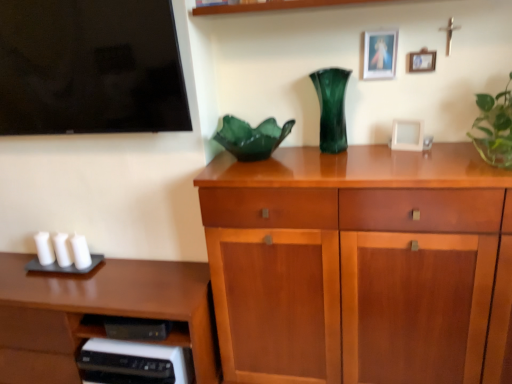
Question: Should I look upward or downward to see white matte candle at left, the second candle viewed from the left?

Choices:
 (A) up
 (B) down

Answer: (B)

Question: Can you confirm if white matte picture frame at upper right, which is counted as the third picture frame, starting from the top, is wider than wooden cabinet at center?

Choices:
 (A) yes
 (B) no

Answer: (B)

Question: Is white matte picture frame at upper right, which is counted as the third picture frame, starting from the top, far from wooden cabinet at center?

Choices:
 (A) no
 (B) yes

Answer: (A)

Question: Is white matte picture frame at upper right, marked as the 1th picture frame in a bottom-to-top arrangement, shorter than wooden cabinet at center?

Choices:
 (A) yes
 (B) no

Answer: (A)

Question: From a real-world perspective, is white matte picture frame at upper right, which is counted as the third picture frame, starting from the top, located beneath wooden cabinet at center?

Choices:
 (A) yes
 (B) no

Answer: (B)

Question: Could you tell me if white matte picture frame at upper right, marked as the 1th picture frame in a bottom-to-top arrangement, is facing wooden cabinet at center?

Choices:
 (A) yes
 (B) no

Answer: (B)

Question: Considering the relative sizes of white matte picture frame at upper right, marked as the 1th picture frame in a bottom-to-top arrangement, and wooden cabinet at center in the image provided, is white matte picture frame at upper right, marked as the 1th picture frame in a bottom-to-top arrangement, taller than wooden cabinet at center?

Choices:
 (A) yes
 (B) no

Answer: (B)

Question: Is green glossy plant at right, arranged as the 1th houseplant when viewed from the right, at the right side of green glass vase at center?

Choices:
 (A) no
 (B) yes

Answer: (B)

Question: Considering the relative sizes of green glossy plant at right, arranged as the 1th houseplant when viewed from the right, and green glass vase at center in the image provided, is green glossy plant at right, arranged as the 1th houseplant when viewed from the right, thinner than green glass vase at center?

Choices:
 (A) no
 (B) yes

Answer: (A)

Question: Is green glossy plant at right, arranged as the 1th houseplant when viewed from the right, to the left of green glass vase at center from the viewer's perspective?

Choices:
 (A) no
 (B) yes

Answer: (A)

Question: Is green glossy plant at right, which is the second houseplant in left-to-right order, not within green glass vase at center?

Choices:
 (A) no
 (B) yes

Answer: (B)

Question: Does green glossy plant at right, arranged as the 1th houseplant when viewed from the right, lie behind green glass vase at center?

Choices:
 (A) yes
 (B) no

Answer: (B)

Question: From a real-world perspective, is green glossy plant at right, which is the second houseplant in left-to-right order, over green glass vase at center?

Choices:
 (A) no
 (B) yes

Answer: (B)

Question: Considering the relative sizes of matte gold picture frame at upper right, the first picture frame from the top, and wooden cabinet at center in the image provided, is matte gold picture frame at upper right, the first picture frame from the top, shorter than wooden cabinet at center?

Choices:
 (A) yes
 (B) no

Answer: (A)